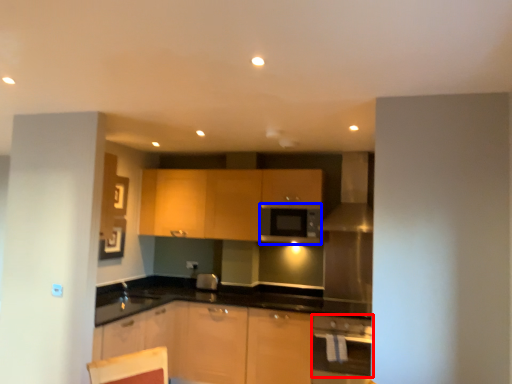
Question: Among these objects, which one is farthest to the camera, kitchen appliance (highlighted by a red box) or appliance (highlighted by a blue box)?

Choices:
 (A) kitchen appliance
 (B) appliance

Answer: (B)